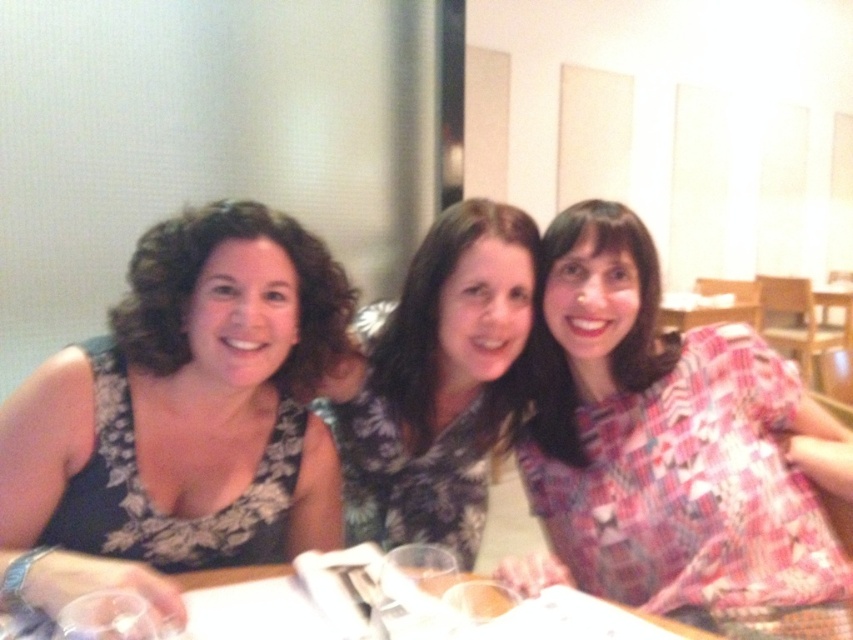
Question: Estimate the real-world distances between objects in this image. Which object is farther from the floral fabric dress at center?

Choices:
 (A) clear glass wine glass at center
 (B) transparent plastic wine glass at lower left
 (C) wooden table at center

Answer: (B)

Question: Among these objects, which one is nearest to the camera?

Choices:
 (A) transparent plastic wine glass at lower left
 (B) clear glass wine glass at center
 (C) floral fabric dress at center

Answer: (A)

Question: Considering the relative positions of floral fabric dress at center and wooden table at center in the image provided, where is floral fabric dress at center located with respect to wooden table at center?

Choices:
 (A) above
 (B) below

Answer: (A)

Question: Can you confirm if floral fabric dress at center is bigger than clear glass wine glass at center?

Choices:
 (A) no
 (B) yes

Answer: (B)

Question: Which object is farther from the camera taking this photo?

Choices:
 (A) wooden table at center
 (B) transparent plastic wine glass at lower left
 (C) clear glass wine glass at center

Answer: (C)

Question: Does wooden table at center appear on the right side of clear glass wine glass at center?

Choices:
 (A) yes
 (B) no

Answer: (A)